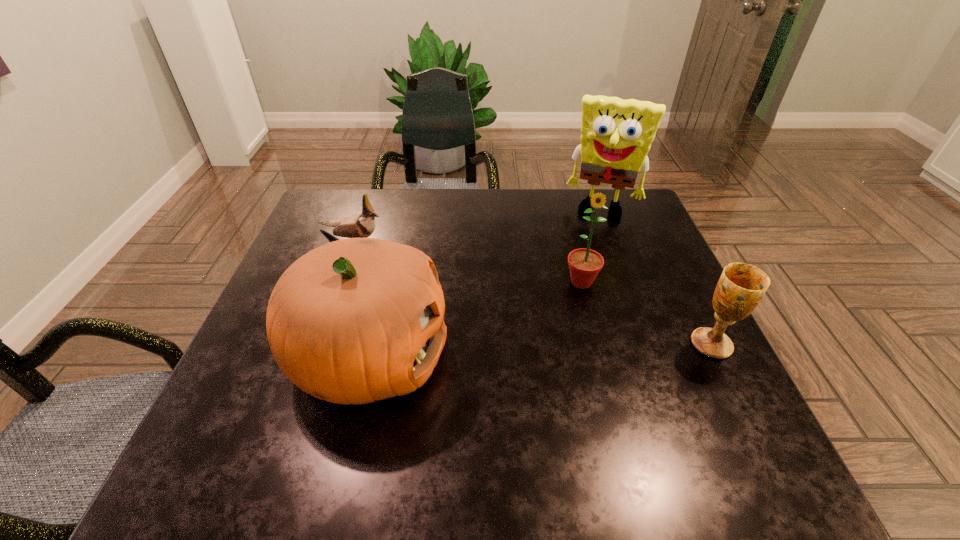
At what (x,y) coordinates should I click in order to perform the action: click on vacant space at the right edge of the desktop. Please return your answer as a coordinate pair (x, y). Looking at the image, I should click on [x=649, y=237].

In order to click on vacant space at the far left corner of the desktop in this screenshot , I will do `click(310, 221)`.

Where is `vacant space at the near left corner of the desktop`? The image size is (960, 540). vacant space at the near left corner of the desktop is located at coordinates (226, 395).

The width and height of the screenshot is (960, 540). I want to click on vacant space at the far right corner, so [628, 225].

Where is `vacant space at the near right corner of the desktop`? vacant space at the near right corner of the desktop is located at coordinates (739, 406).

Image resolution: width=960 pixels, height=540 pixels. I want to click on unoccupied area between the bird and the chalice, so click(532, 293).

Find the location of `unoccupied area between the pumpkin and the chalice`. unoccupied area between the pumpkin and the chalice is located at coordinates (540, 350).

The height and width of the screenshot is (540, 960). Find the location of `empty space between the sunflower and the pumpkin`. empty space between the sunflower and the pumpkin is located at coordinates (475, 319).

Identify the location of vacant area between the bird and the third nearest object. coord(467,262).

You are a GUI agent. You are given a task and a screenshot of the screen. Output one action in this format:
    pyautogui.click(x=<x>, y=<y>)
    Task: Click on the vacant point located between the pumpkin and the chalice
    Image resolution: width=960 pixels, height=540 pixels.
    Given the screenshot: What is the action you would take?
    pyautogui.click(x=540, y=350)